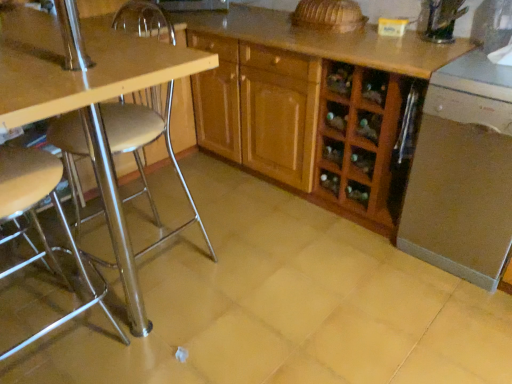
Where is `free location to the left of metallic silver stool at left`? free location to the left of metallic silver stool at left is located at coordinates (97, 333).